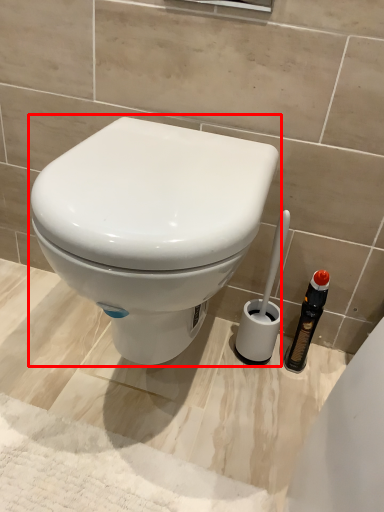
Question: Where is toilet (annotated by the red box) located in relation to brush in the image?

Choices:
 (A) right
 (B) left

Answer: (B)